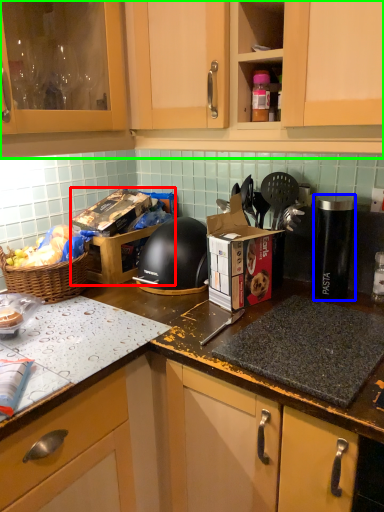
Question: Considering the real-world distances, which object is closest to cardboard box (highlighted by a red box)? appliance (highlighted by a blue box) or cabinetry (highlighted by a green box).

Choices:
 (A) appliance
 (B) cabinetry

Answer: (B)